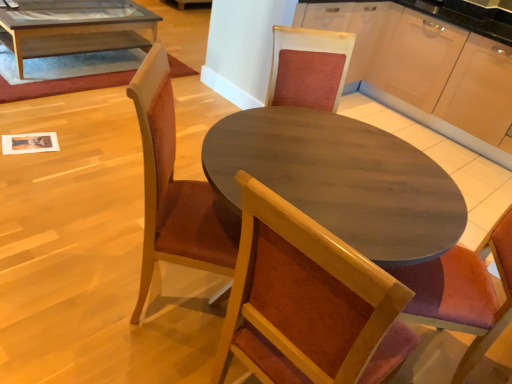
Question: Considering the relative positions of wooden chair at center and clear glass coffee table at upper left in the image provided, is wooden chair at center to the left or to the right of clear glass coffee table at upper left?

Choices:
 (A) left
 (B) right

Answer: (B)

Question: Is wooden chair at center spatially inside clear glass coffee table at upper left, or outside of it?

Choices:
 (A) inside
 (B) outside

Answer: (B)

Question: Considering the positions of wooden chair at center and clear glass coffee table at upper left in the image, is wooden chair at center wider or thinner than clear glass coffee table at upper left?

Choices:
 (A) thin
 (B) wide

Answer: (A)

Question: Does point (89, 43) appear closer or farther from the camera than point (215, 226)?

Choices:
 (A) farther
 (B) closer

Answer: (A)

Question: Considering their positions, is clear glass coffee table at upper left located in front of or behind wooden chair at center?

Choices:
 (A) front
 (B) behind

Answer: (B)

Question: From the image's perspective, is clear glass coffee table at upper left located above or below wooden chair at center?

Choices:
 (A) below
 (B) above

Answer: (B)

Question: Considering the positions of clear glass coffee table at upper left and wooden chair at center in the image, is clear glass coffee table at upper left taller or shorter than wooden chair at center?

Choices:
 (A) short
 (B) tall

Answer: (A)